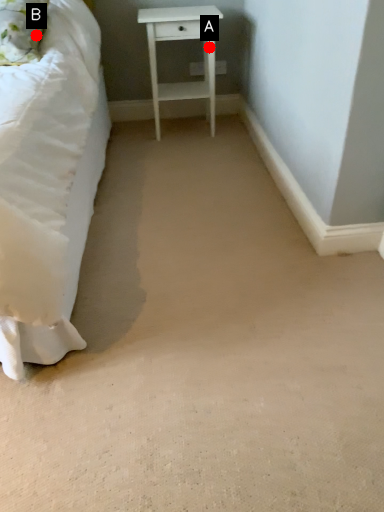
Question: Two points are circled on the image, labeled by A and B beside each circle. Which of the following is the farthest from the observer?

Choices:
 (A) A is further
 (B) B is further

Answer: (A)